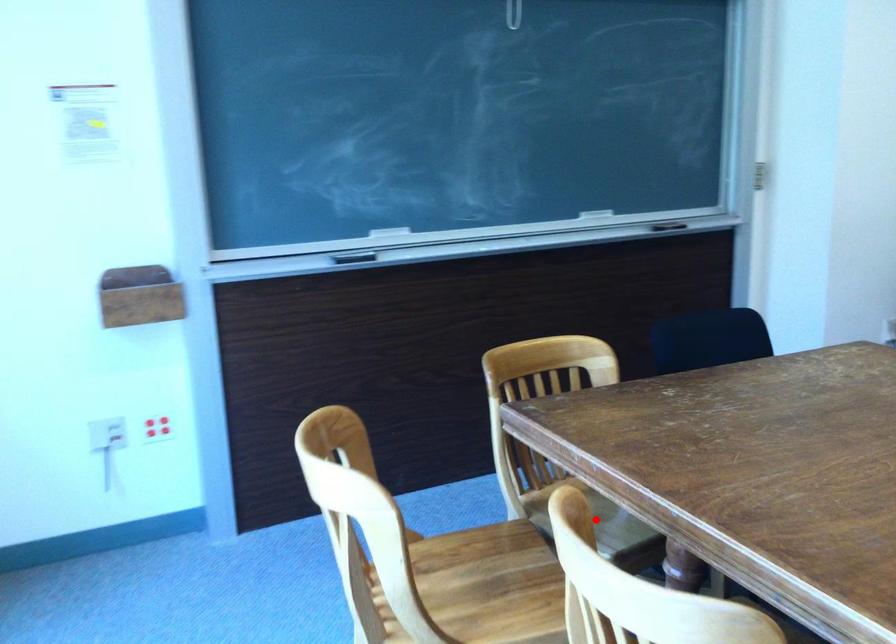
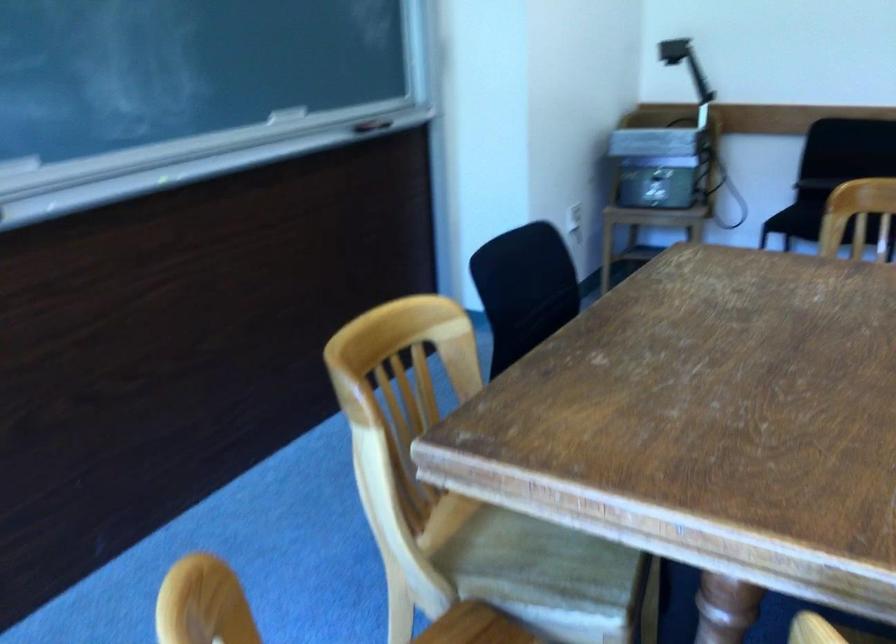
Where in the second image is the point corresponding to the highlighted location from the first image?

(528, 556)